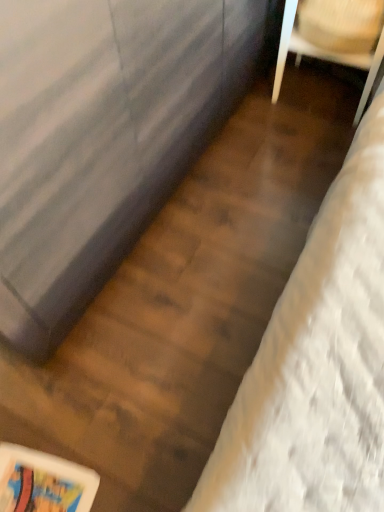
I want to click on free space in front of wooden chair at upper right, so click(x=303, y=151).